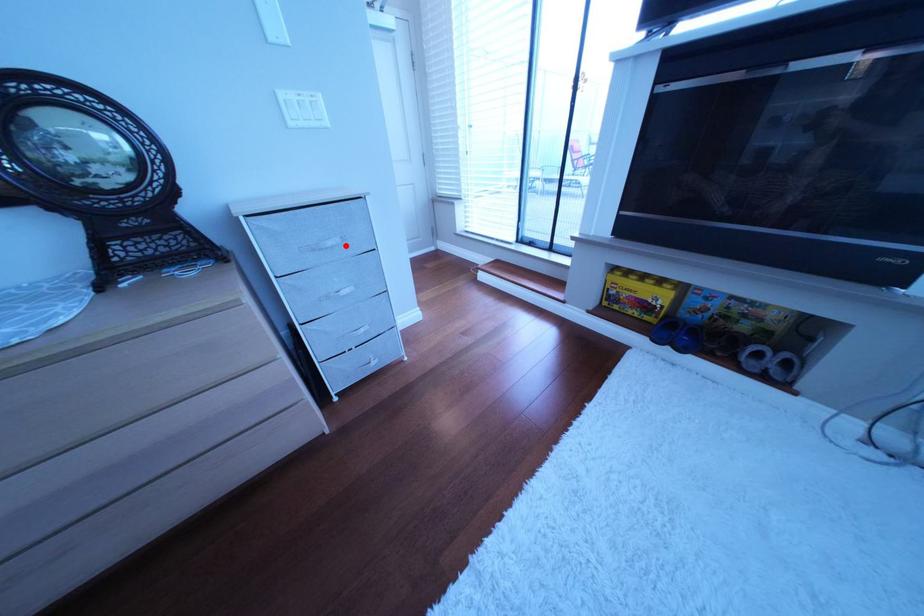
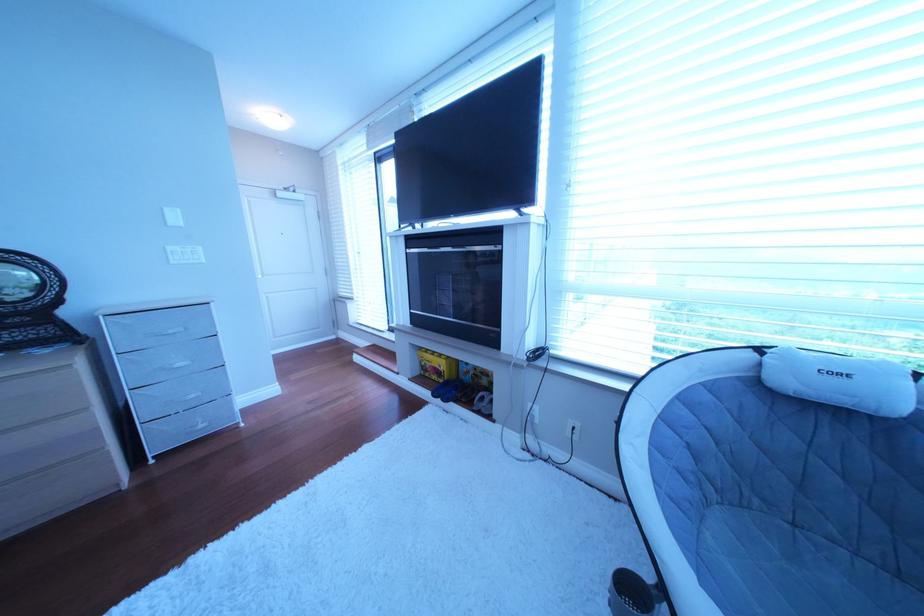
Find the pixel in the second image that matches the highlighted location in the first image.

(188, 334)